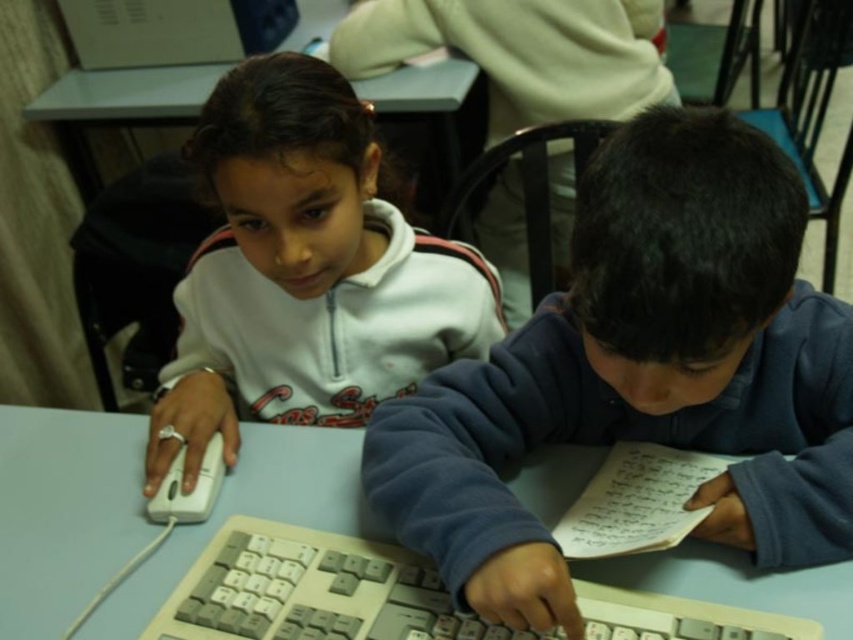
Question: Among these objects, which one is farthest from the camera?

Choices:
 (A) gray plastic keyboard at center
 (B) white matte mouse at left
 (C) dark blue fleece at center
 (D) white matte mouse at lower left

Answer: (D)

Question: Does dark blue fleece at center appear under white matte mouse at lower left?

Choices:
 (A) yes
 (B) no

Answer: (B)

Question: Can you confirm if gray plastic keyboard at center is positioned to the left of white matte mouse at lower left?

Choices:
 (A) no
 (B) yes

Answer: (A)

Question: Is white plastic table at center to the left of white matte mouse at lower left from the viewer's perspective?

Choices:
 (A) no
 (B) yes

Answer: (A)

Question: Which object is the closest to the white matte mouse at lower left?

Choices:
 (A) white matte mouse at left
 (B) white plastic computer at upper left

Answer: (A)

Question: Which of the following is the closest to the observer?

Choices:
 (A) dark blue fleece at center
 (B) gray plastic keyboard at center

Answer: (A)